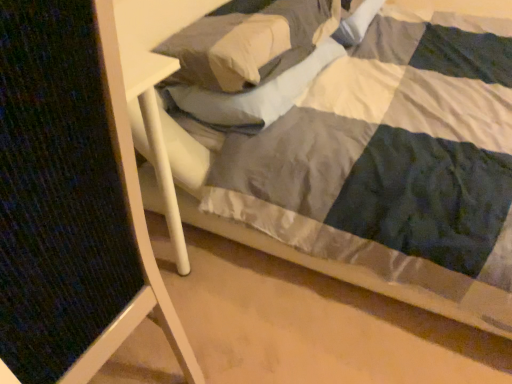
Question: Would you say textured fabric folding chair at left is to the left or to the right of soft white pillow at upper center in the picture?

Choices:
 (A) left
 (B) right

Answer: (A)

Question: Is textured fabric folding chair at left spatially inside soft white pillow at upper center, or outside of it?

Choices:
 (A) inside
 (B) outside

Answer: (B)

Question: Is point (60, 153) positioned closer to the camera than point (265, 8)?

Choices:
 (A) farther
 (B) closer

Answer: (B)

Question: Is soft white pillow at upper center in front of or behind textured fabric folding chair at left in the image?

Choices:
 (A) behind
 (B) front

Answer: (A)

Question: Considering the positions of soft white pillow at upper center and textured fabric folding chair at left in the image, is soft white pillow at upper center bigger or smaller than textured fabric folding chair at left?

Choices:
 (A) small
 (B) big

Answer: (A)

Question: From the image's perspective, relative to textured fabric folding chair at left, is soft white pillow at upper center above or below?

Choices:
 (A) above
 (B) below

Answer: (A)

Question: Considering the positions of soft white pillow at upper center and textured fabric folding chair at left in the image, is soft white pillow at upper center wider or thinner than textured fabric folding chair at left?

Choices:
 (A) thin
 (B) wide

Answer: (B)